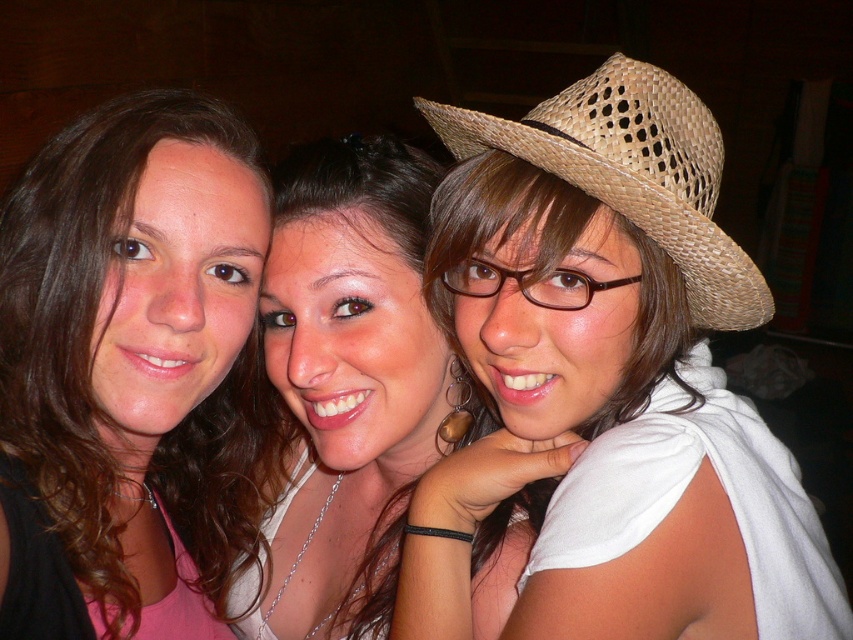
Does matte pink shirt at left appear on the right side of matte white shirt at center?

In fact, matte pink shirt at left is to the left of matte white shirt at center.

What do you see at coordinates (123, 365) in the screenshot? The height and width of the screenshot is (640, 853). I see `matte pink shirt at left` at bounding box center [123, 365].

Where is `matte pink shirt at left`? This screenshot has width=853, height=640. matte pink shirt at left is located at coordinates (123, 365).

Can you confirm if matte pink shirt at left is shorter than woven straw cowboy hat at upper right?

No.

Which is more to the left, matte pink shirt at left or woven straw cowboy hat at upper right?

matte pink shirt at left

Find the location of `matte pink shirt at left`. matte pink shirt at left is located at coordinates (123, 365).

Does matte white shirt at center appear on the right side of woven straw cowboy hat at upper right?

Incorrect, matte white shirt at center is not on the right side of woven straw cowboy hat at upper right.

Is matte white shirt at center further to the viewer compared to woven straw cowboy hat at upper right?

Yes, matte white shirt at center is behind woven straw cowboy hat at upper right.

Where is `matte white shirt at center`? matte white shirt at center is located at coordinates (334, 396).